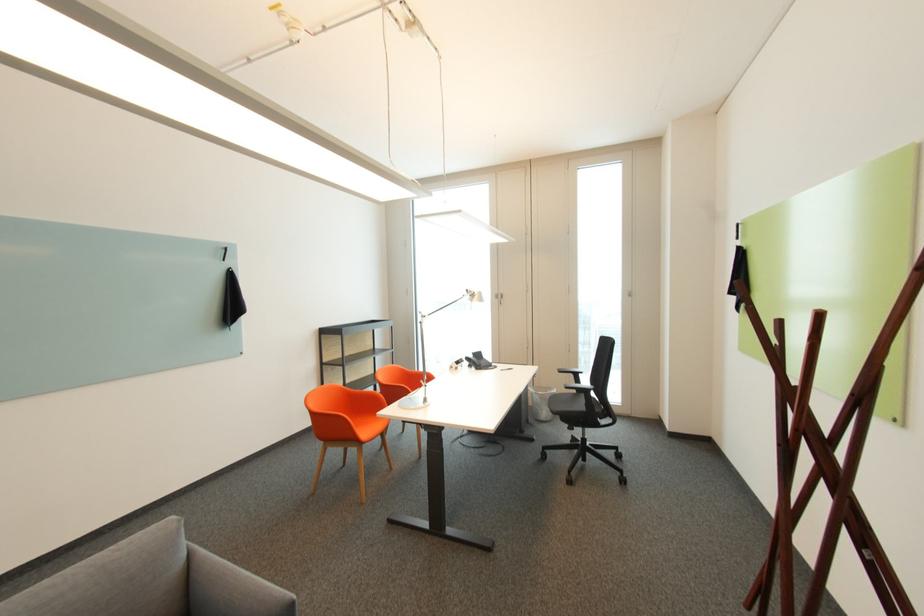
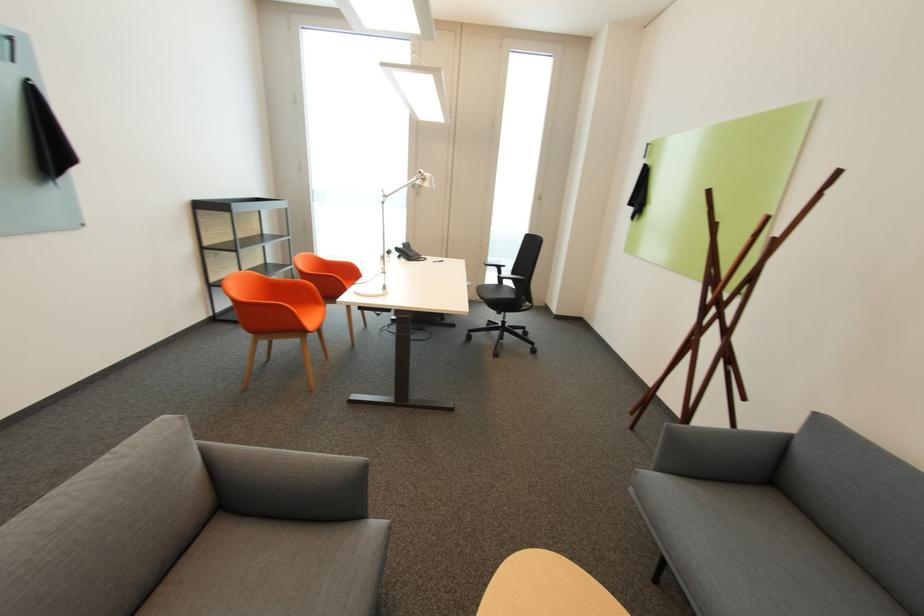
Where in the second image is the point corresponding to (x=237, y=278) from the first image?

(43, 99)